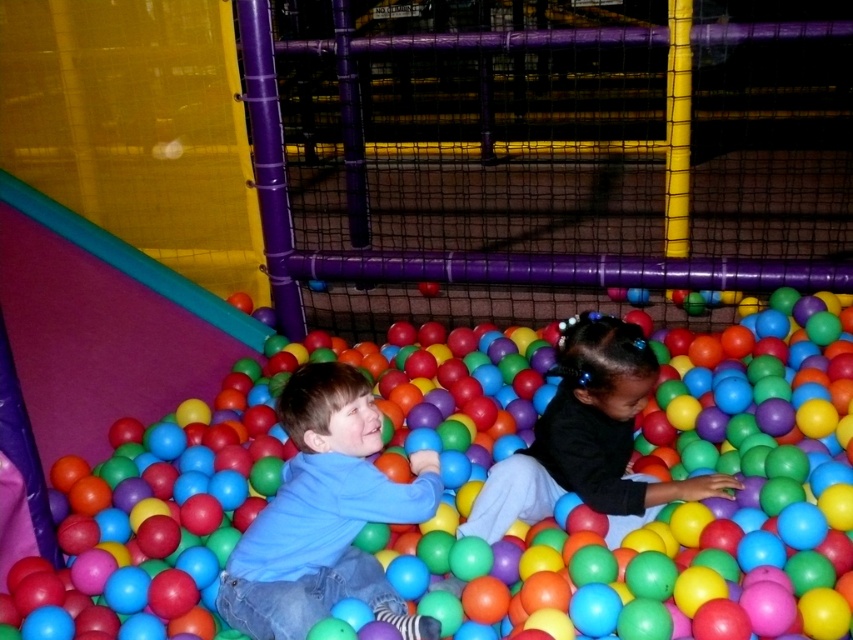
Question: Is rubber ball pit at center bigger than blue matte shirt at center?

Choices:
 (A) yes
 (B) no

Answer: (A)

Question: Among these points, which one is farthest from the camera?

Choices:
 (A) (730, 566)
 (B) (228, 588)
 (C) (595, 476)

Answer: (C)

Question: Can you confirm if blue matte shirt at center is positioned to the left of black matte shirt at center?

Choices:
 (A) yes
 (B) no

Answer: (A)

Question: Does rubber ball pit at center appear under black matte shirt at center?

Choices:
 (A) yes
 (B) no

Answer: (B)

Question: Estimate the real-world distances between objects in this image. Which object is closer to the blue matte shirt at center?

Choices:
 (A) rubber ball pit at center
 (B) black matte shirt at center

Answer: (A)

Question: Which object is the farthest from the black matte shirt at center?

Choices:
 (A) rubber ball pit at center
 (B) blue matte shirt at center

Answer: (B)